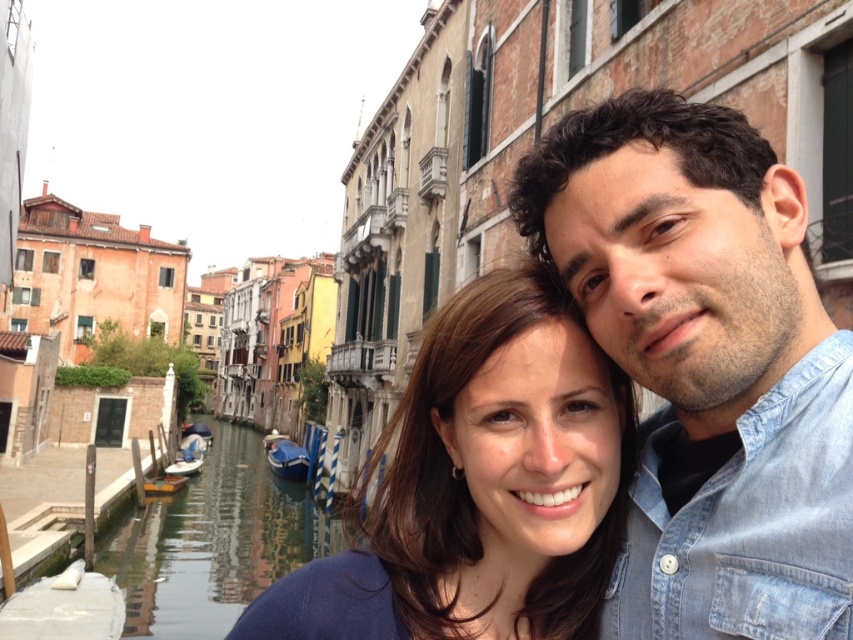
Can you confirm if blue glossy boat at lower left is bigger than white plastic boat at lower left?

Indeed, blue glossy boat at lower left has a larger size compared to white plastic boat at lower left.

Does blue glossy boat at lower left have a greater width compared to white plastic boat at lower left?

Indeed, blue glossy boat at lower left has a greater width compared to white plastic boat at lower left.

Is point (300, 458) positioned behind point (189, 474)?

Yes, it is behind point (189, 474).

Locate an element on the screen. This screenshot has width=853, height=640. blue glossy boat at lower left is located at coordinates (286, 458).

From the picture: Between brown hair at center and smooth water at lower left, which one has less height?

smooth water at lower left

Image resolution: width=853 pixels, height=640 pixels. What do you see at coordinates (482, 484) in the screenshot?
I see `brown hair at center` at bounding box center [482, 484].

Identify the location of brown hair at center. The height and width of the screenshot is (640, 853). (482, 484).

This screenshot has height=640, width=853. Identify the location of brown hair at center. (482, 484).

Who is shorter, blue denim shirt at center or white plastic boat at lower left?

Standing shorter between the two is white plastic boat at lower left.

Between point (646, 548) and point (166, 472), which one is positioned in front?

Point (646, 548)

Find the location of a particular element. blue denim shirt at center is located at coordinates (706, 364).